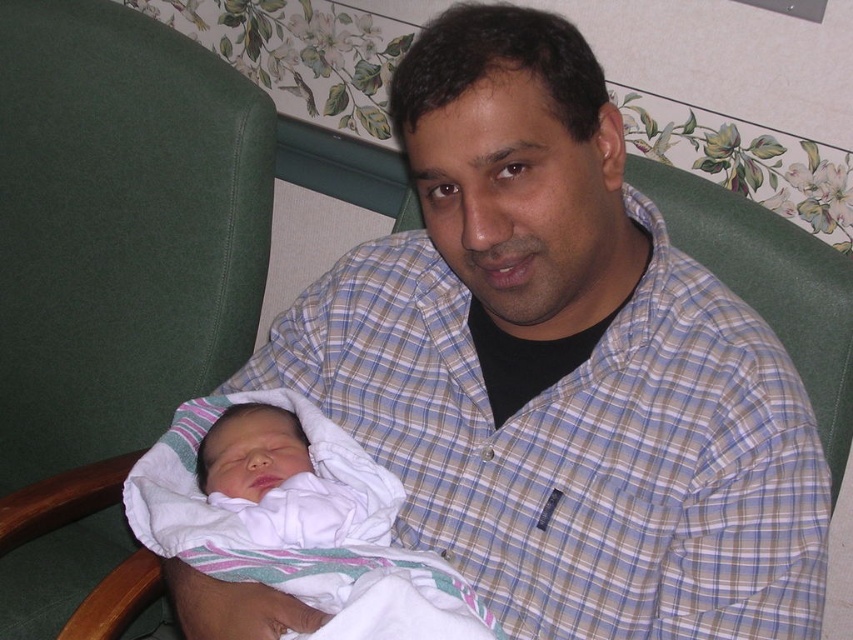
Question: Among these points, which one is nearest to the camera?

Choices:
 (A) tap(28, 266)
 (B) tap(403, 554)

Answer: (B)

Question: Does green fabric swivel chair at left have a lesser width compared to white soft cloth at center?

Choices:
 (A) no
 (B) yes

Answer: (A)

Question: Which of the following is the farthest from the observer?

Choices:
 (A) green fabric swivel chair at left
 (B) white soft cloth at center

Answer: (A)

Question: Which point is farther to the camera?

Choices:
 (A) (457, 595)
 (B) (131, 104)

Answer: (B)

Question: Can you confirm if green fabric swivel chair at left is positioned above white soft cloth at center?

Choices:
 (A) yes
 (B) no

Answer: (A)

Question: Can you confirm if green fabric swivel chair at left is positioned to the left of white soft cloth at center?

Choices:
 (A) no
 (B) yes

Answer: (B)